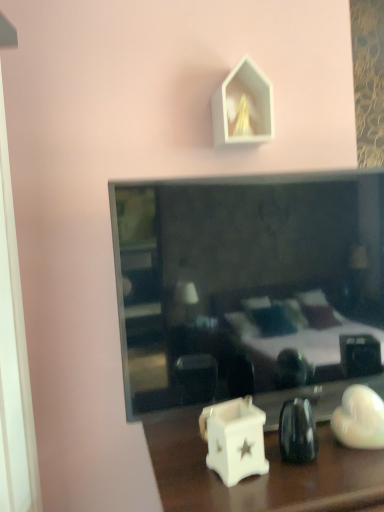
Question: In which direction should I rotate to look at white ceramic candle holder at lower center?

Choices:
 (A) right
 (B) left

Answer: (A)

Question: Is smooth glass mirror at center a part of white matte house-shaped object at upper center?

Choices:
 (A) no
 (B) yes

Answer: (A)

Question: Can you confirm if white matte house-shaped object at upper center is positioned to the left of smooth glass mirror at center?

Choices:
 (A) yes
 (B) no

Answer: (A)

Question: Does white matte house-shaped object at upper center come behind smooth glass mirror at center?

Choices:
 (A) yes
 (B) no

Answer: (A)

Question: Does white matte house-shaped object at upper center have a smaller size compared to smooth glass mirror at center?

Choices:
 (A) no
 (B) yes

Answer: (B)

Question: Does white matte house-shaped object at upper center have a lesser width compared to smooth glass mirror at center?

Choices:
 (A) no
 (B) yes

Answer: (B)

Question: From the image's perspective, is white matte house-shaped object at upper center below smooth glass mirror at center?

Choices:
 (A) no
 (B) yes

Answer: (A)

Question: Is smooth glass mirror at center thinner than white ceramic candle holder at lower center?

Choices:
 (A) no
 (B) yes

Answer: (A)

Question: Can you confirm if smooth glass mirror at center is positioned to the right of white ceramic candle holder at lower center?

Choices:
 (A) yes
 (B) no

Answer: (A)

Question: Is smooth glass mirror at center closer to camera compared to white ceramic candle holder at lower center?

Choices:
 (A) no
 (B) yes

Answer: (A)

Question: Does smooth glass mirror at center have a greater height compared to white ceramic candle holder at lower center?

Choices:
 (A) no
 (B) yes

Answer: (B)

Question: From the image's perspective, is smooth glass mirror at center below white ceramic candle holder at lower center?

Choices:
 (A) no
 (B) yes

Answer: (A)

Question: Are smooth glass mirror at center and white ceramic candle holder at lower center located far from each other?

Choices:
 (A) no
 (B) yes

Answer: (A)

Question: Can you confirm if white glossy candle holder at lower center is positioned to the left of white matte house-shaped object at upper center?

Choices:
 (A) no
 (B) yes

Answer: (A)